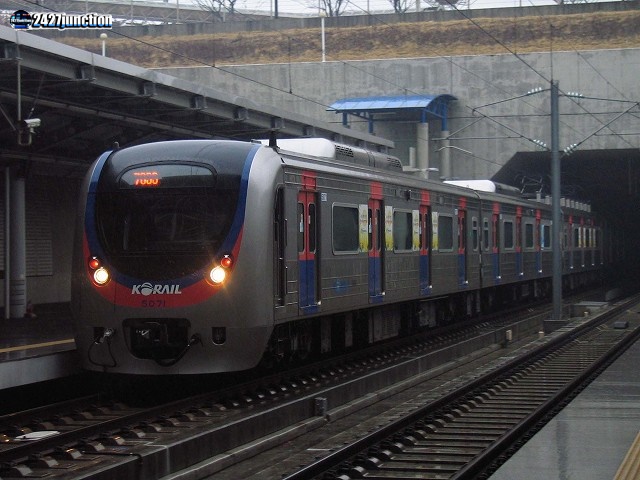
The height and width of the screenshot is (480, 640). Find the location of `window`. window is located at coordinates (164, 224), (346, 218), (399, 233), (444, 234), (513, 237), (527, 238), (547, 240), (573, 240), (582, 240), (596, 238).